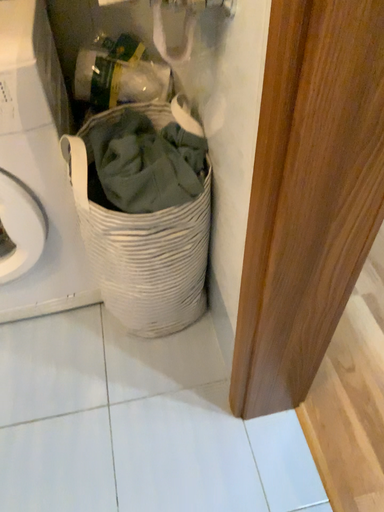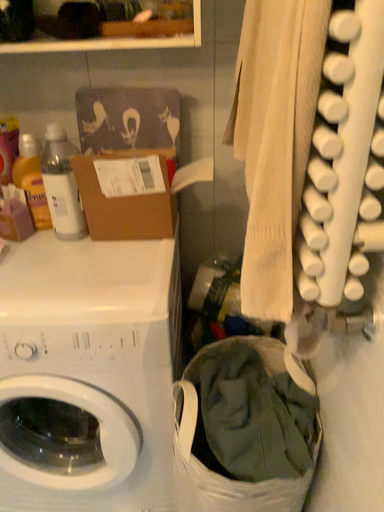
Question: Which way did the camera rotate in the video?

Choices:
 (A) rotated downward
 (B) rotated upward

Answer: (B)